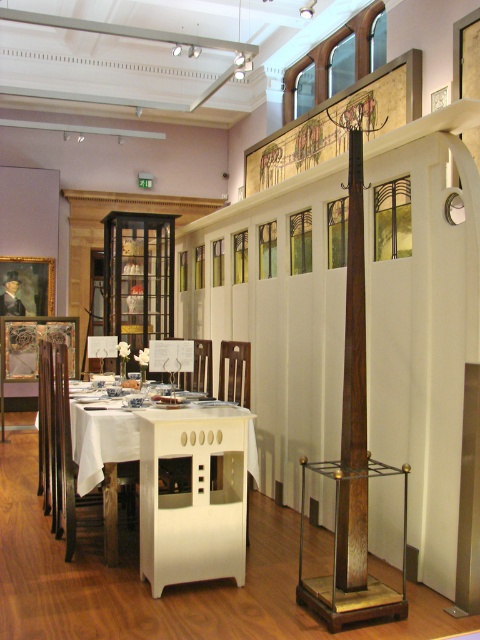
Which is behind, point (88, 449) or point (222, 340)?

Positioned behind is point (222, 340).

Is point (92, 440) less distant than point (244, 381)?

That is True.

In order to click on white glossy table at center in this screenshot , I will do `click(107, 470)`.

The image size is (480, 640). Describe the element at coordinates (56, 444) in the screenshot. I see `mahogany wood chair at center` at that location.

Does mahogany wood chair at center appear over white glossy table at center?

Indeed, mahogany wood chair at center is positioned over white glossy table at center.

Image resolution: width=480 pixels, height=640 pixels. I want to click on mahogany wood chair at center, so click(56, 444).

Does brown polished wood umbrella stand at center appear on the right side of mahogany wood chair at center?

Indeed, brown polished wood umbrella stand at center is positioned on the right side of mahogany wood chair at center.

Who is lower down, brown polished wood umbrella stand at center or mahogany wood chair at center?

mahogany wood chair at center is lower down.

Who is more forward, (349, 522) or (41, 353)?

Point (349, 522) is more forward.

Locate an element on the screen. The image size is (480, 640). brown polished wood umbrella stand at center is located at coordinates (355, 321).